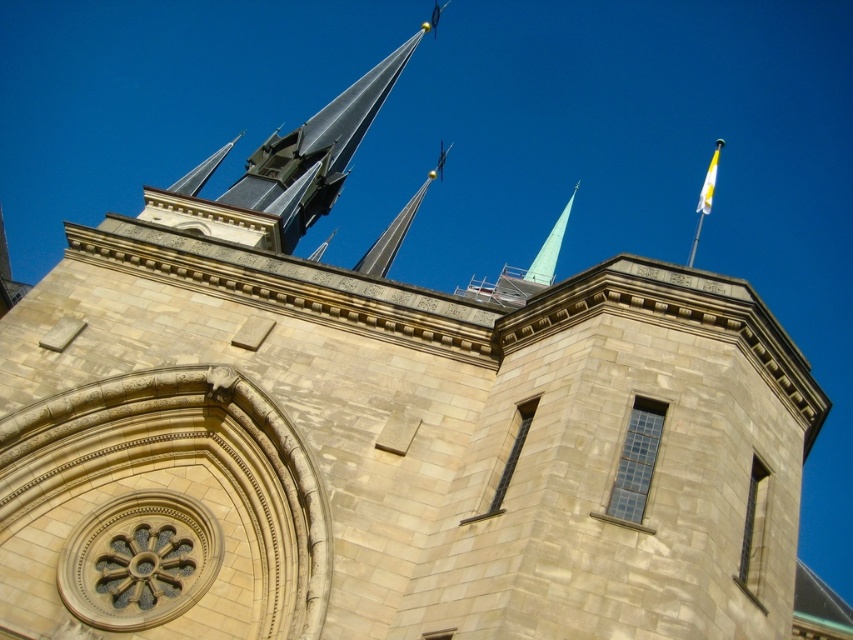
You are standing in front of the church and notice the shiny metallic spire at center and the yellow fabric flag at upper right. Which object is closer to the top of the building?

The yellow fabric flag at upper right is closer to the top of the building because it is positioned above the shiny metallic spire at center.

You are an architect designing a new church and want to ensure the shiny metallic spire at center and the light blue glass spire at upper center are proportionate. Based on the image, which spire should be placed higher to maintain architectural harmony?

The shiny metallic spire at center should be placed higher than the light blue glass spire at upper center to maintain architectural harmony, as it is taller in the original design.